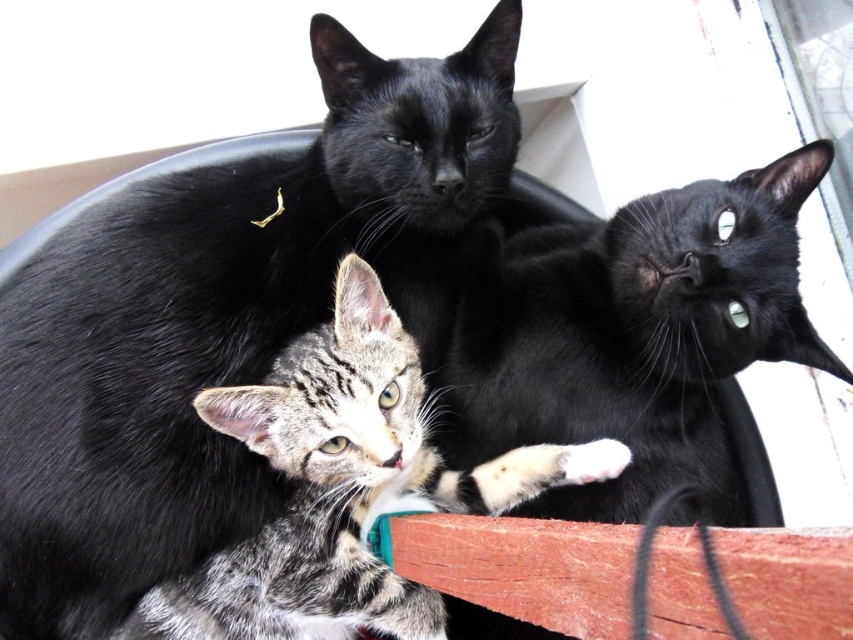
You are standing in front of the wooden surface where the cats are resting. You want to place a small treat exactly at the point marked by coordinates point (223, 317). Which cat is closest to this point?

The point (223, 317) corresponds to the shiny black cat at upper center, so the shiny black cat at upper center is closest to this point.

You are a photographer holding a camera that requires a minimum distance of 14 inches between the subject and the lens to focus properly. You want to take a clear photo of both the shiny black cat at upper center and the black glossy cat at upper right. Can you focus on both cats at the same time if they are currently 12.93 inches apart?

The shiny black cat at upper center is 12.93 inches away from the black glossy cat at upper right. Since the minimum focusing distance required is 14 inches, the distance between them is insufficient. Therefore, you cannot focus on both cats simultaneously.